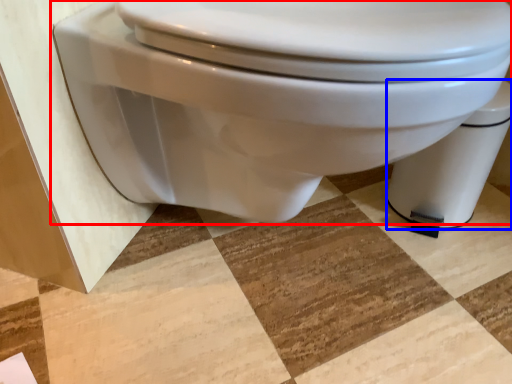
Question: Which object is further to the camera taking this photo, toilet (highlighted by a red box) or toilet bowl (highlighted by a blue box)?

Choices:
 (A) toilet
 (B) toilet bowl

Answer: (B)